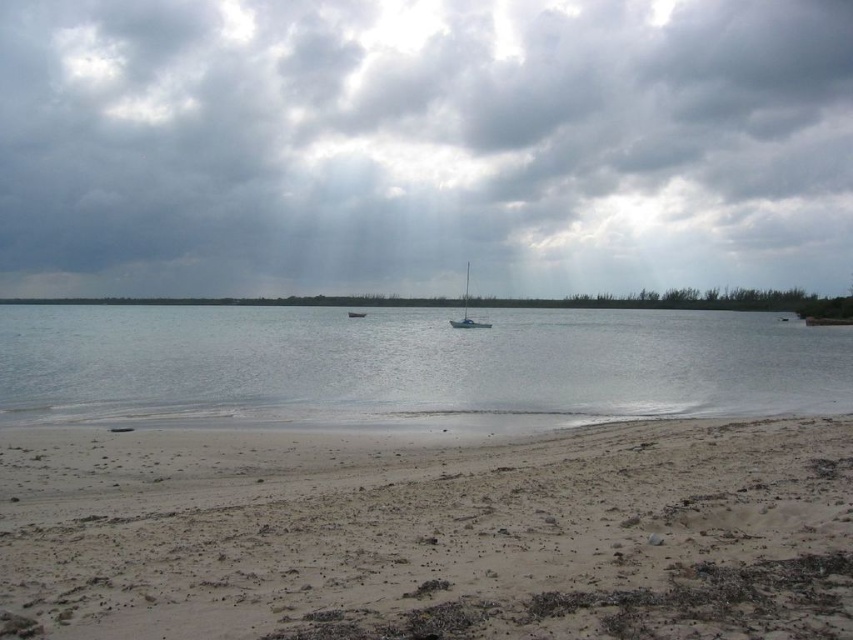
You are standing on the beach and want to walk from point A to point B. Point A is at coordinate point (x=558, y=140) and point B is at coordinate point (x=320, y=451). Which point is closer to you when you start walking?

Point A at coordinate point (x=558, y=140) is closer to you than point B at coordinate point (x=320, y=451) because it is further to the viewer according to the description.

You are a drone operator trying to capture a photo of the light brown sandy beach at lower center. The drone is currently at coordinates point A. To ensure the beach is centered in the photo, should you move the drone north or south? Please explain using the coordinates provided.

The light brown sandy beach at lower center is located at coordinates point A. To center it in the photo, the drone should remain at point A as it is already centered.